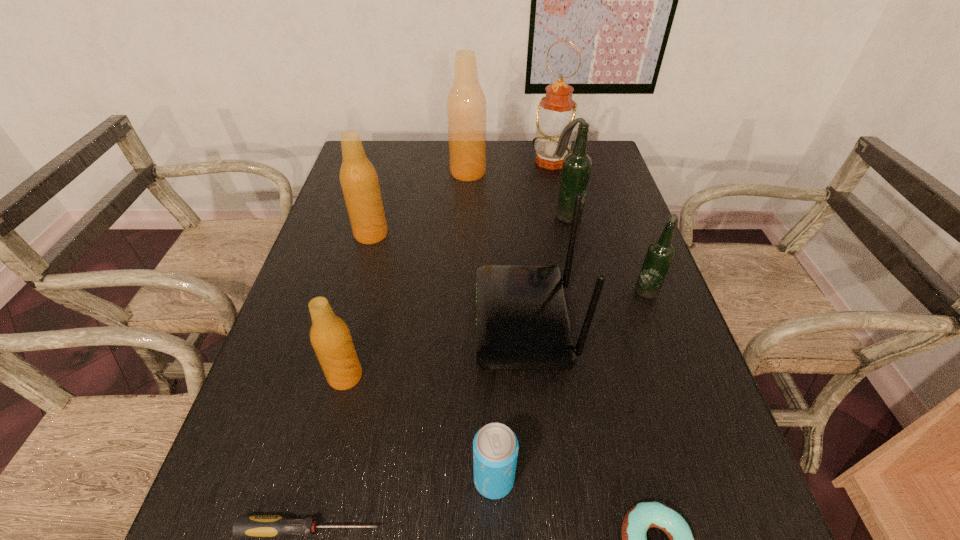
The height and width of the screenshot is (540, 960). What are the coordinates of `vacant area between the second nearest tan beer bottle and the fourth farthest beer bottle` in the screenshot? It's located at (509, 262).

Find the location of `free space that is in between the oil lamp and the second biggest tan beer bottle`. free space that is in between the oil lamp and the second biggest tan beer bottle is located at coordinates (461, 198).

Find the location of a particular element. The width and height of the screenshot is (960, 540). vacant area that lies between the router and the farthest tan beer bottle is located at coordinates (496, 247).

This screenshot has height=540, width=960. I want to click on empty location between the second farthest tan beer bottle and the farther dark beer bottle, so click(468, 225).

You are a GUI agent. You are given a task and a screenshot of the screen. Output one action in this format:
    pyautogui.click(x=<x>, y=<y>)
    Task: Click on the free spot between the smallest tan beer bottle and the router
    The image size is (960, 540).
    Given the screenshot: What is the action you would take?
    pyautogui.click(x=435, y=349)

Choose which object is the fifth nearest neighbor to the oil lamp. Please provide its 2D coordinates. Your answer should be formatted as a tuple, i.e. [(x, y)], where the tuple contains the x and y coordinates of a point satisfying the conditions above.

[(359, 181)]

Identify which object is the fifth nearest to the oil lamp. Please provide its 2D coordinates. Your answer should be formatted as a tuple, i.e. [(x, y)], where the tuple contains the x and y coordinates of a point satisfying the conditions above.

[(359, 181)]

Identify the location of the closest beer bottle to the second nearest beer bottle. The image size is (960, 540). (577, 165).

You are a GUI agent. You are given a task and a screenshot of the screen. Output one action in this format:
    pyautogui.click(x=<x>, y=<y>)
    Task: Click on the closest beer bottle to the nearest beer bottle
    
    Given the screenshot: What is the action you would take?
    pyautogui.click(x=359, y=181)

Locate an element on the screen. The width and height of the screenshot is (960, 540). tan beer bottle that is the third closest one to the blue doughnut is located at coordinates (466, 105).